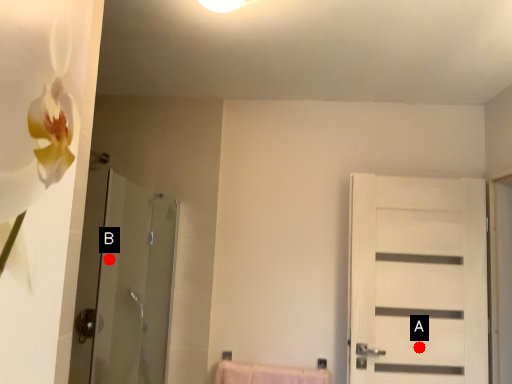
Question: Two points are circled on the image, labeled by A and B beside each circle. Which point is farther to the camera?

Choices:
 (A) A is further
 (B) B is further

Answer: (B)